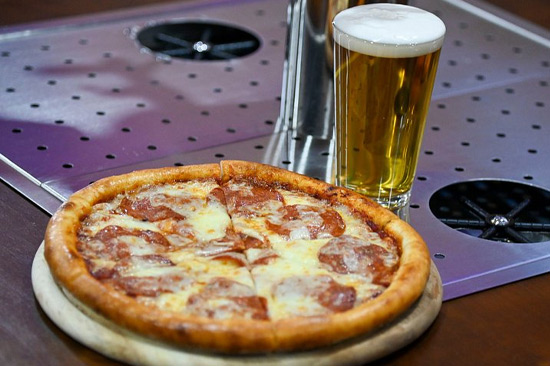
The height and width of the screenshot is (366, 550). What are the coordinates of `foam` in the screenshot? It's located at (380, 28).